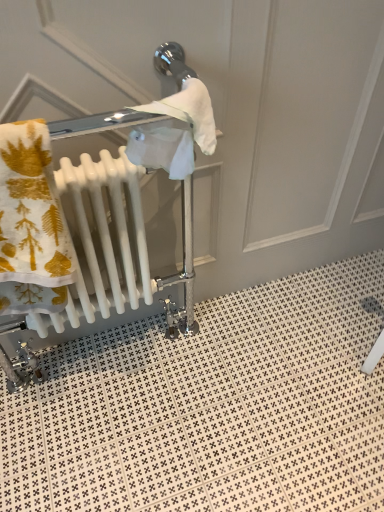
Question: Is white glossy radiator at left surrounding white glossy tile at lower center?

Choices:
 (A) no
 (B) yes

Answer: (A)

Question: Does white glossy radiator at left have a greater height compared to white glossy tile at lower center?

Choices:
 (A) no
 (B) yes

Answer: (B)

Question: Can you confirm if white glossy radiator at left is positioned to the right of white glossy tile at lower center?

Choices:
 (A) no
 (B) yes

Answer: (A)

Question: Is white glossy radiator at left turned away from white glossy tile at lower center?

Choices:
 (A) no
 (B) yes

Answer: (A)

Question: Does white glossy radiator at left have a lesser width compared to white glossy tile at lower center?

Choices:
 (A) no
 (B) yes

Answer: (B)

Question: Does white glossy radiator at left have a greater width compared to white glossy tile at lower center?

Choices:
 (A) yes
 (B) no

Answer: (B)

Question: From a real-world perspective, does white glossy tile at lower center sit lower than white glossy radiator at left?

Choices:
 (A) yes
 (B) no

Answer: (A)

Question: Is white glossy tile at lower center positioned with its back to white glossy radiator at left?

Choices:
 (A) yes
 (B) no

Answer: (B)

Question: Is white glossy tile at lower center positioned behind white glossy radiator at left?

Choices:
 (A) no
 (B) yes

Answer: (B)

Question: From a real-world perspective, is white glossy tile at lower center physically above white glossy radiator at left?

Choices:
 (A) yes
 (B) no

Answer: (B)

Question: Is white glossy tile at lower center at the left side of white glossy radiator at left?

Choices:
 (A) no
 (B) yes

Answer: (A)

Question: Is white glossy tile at lower center taller than white glossy radiator at left?

Choices:
 (A) no
 (B) yes

Answer: (A)

Question: Looking at their shapes, would you say white glossy tile at lower center is wider or thinner than white glossy radiator at left?

Choices:
 (A) wide
 (B) thin

Answer: (A)